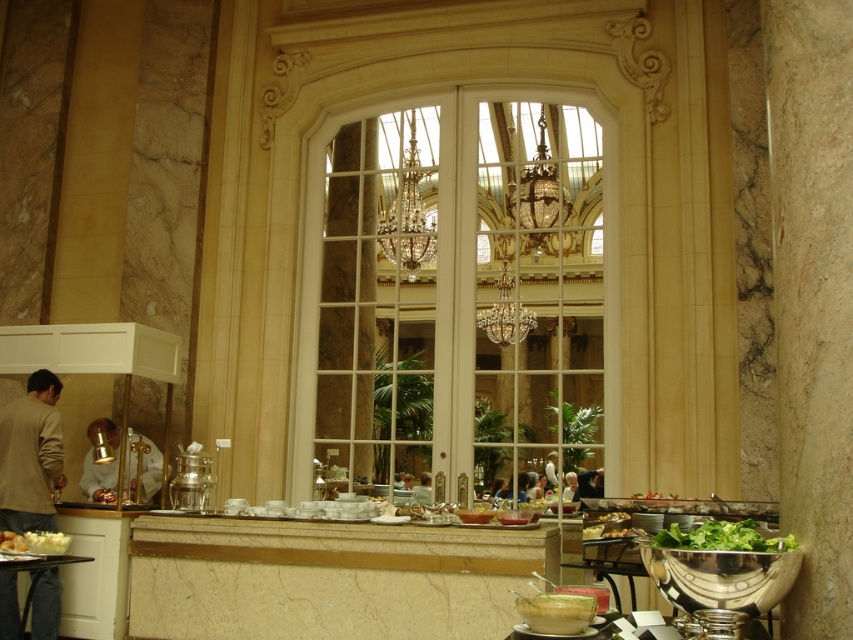
You are a guest at the buffet and want to reach both the white creamy mashed potatoes at lower left and the green leafy salad at lower center. Which one should you approach first if you are standing to the right of both items?

You should approach the white creamy mashed potatoes at lower left first because it is to the left of the green leafy salad at lower center, so it will be closer to you when coming from the right side.